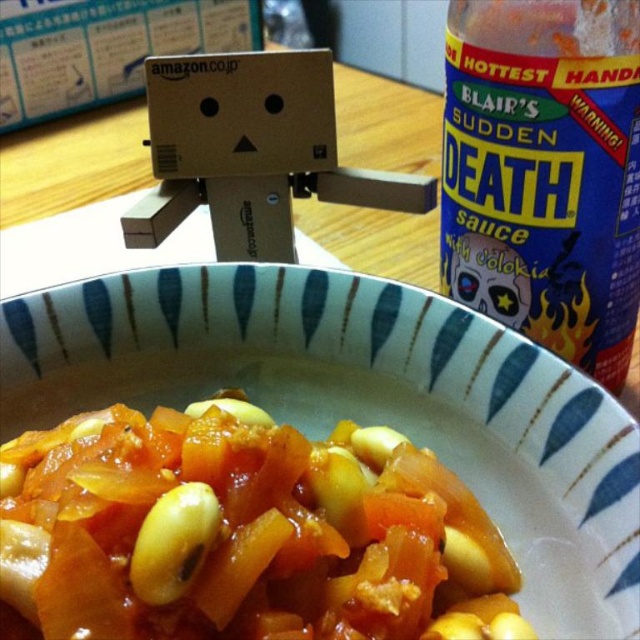
You are holding a small toy that is 2 inches wide. If you want to place it exactly at the point marked as point [93,513] in the image, will it fit without overlapping any other objects?

The point [93,513] is 16.65 inches away from the viewer. Since the toy is only 2 inches wide, it will fit at that point without overlapping any other objects as there is sufficient space.

You are a customer at this Japanese restaurant and want to reach for the blue plastic bottle at upper right and the yellow matte bean at center. Which one is higher up in the image?

The blue plastic bottle at upper right is located above the yellow matte bean at center, so it is higher up in the image.